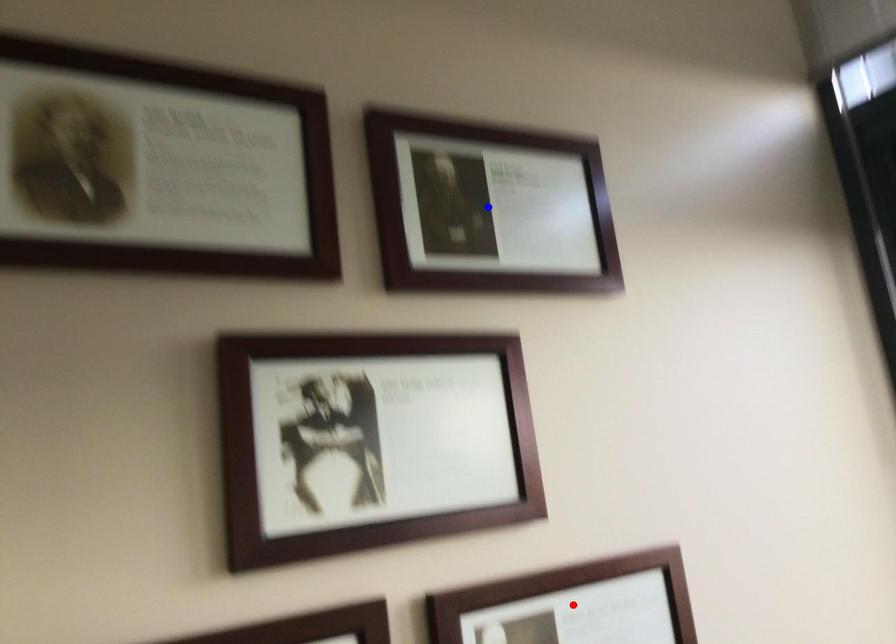
Question: Which of the two points in the image is closer to the camera?

Choices:
 (A) Blue point is closer.
 (B) Red point is closer.

Answer: (B)